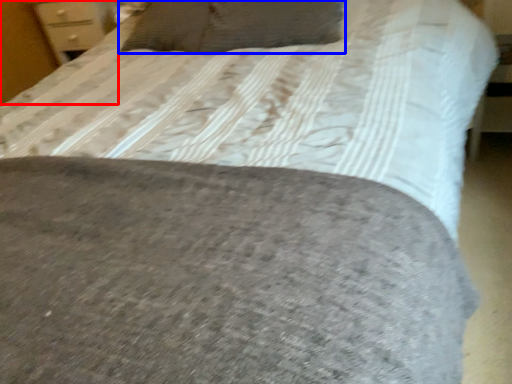
Question: Which point is further to the camera, dresser (highlighted by a red box) or pillow (highlighted by a blue box)?

Choices:
 (A) dresser
 (B) pillow

Answer: (A)